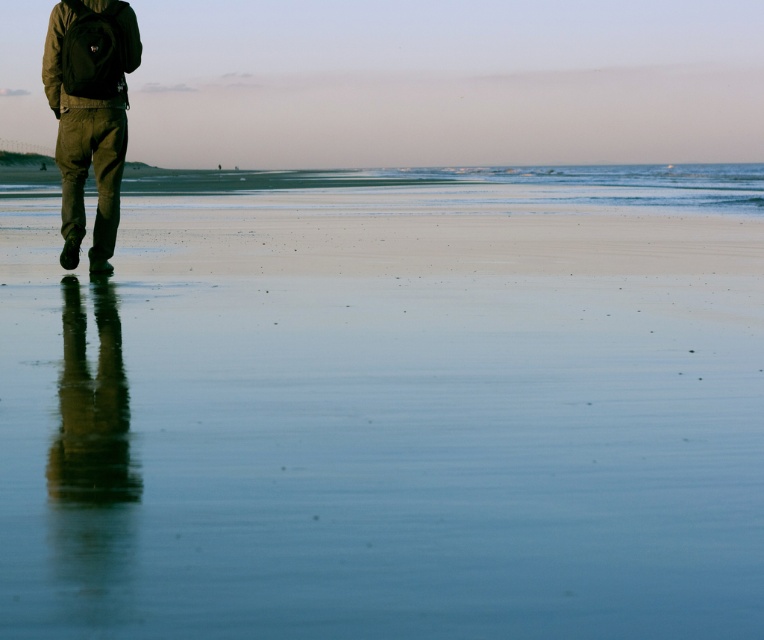
Question: Where is smooth sand at lower left located in relation to olive green corduroy pants at left in the image?

Choices:
 (A) below
 (B) above

Answer: (B)

Question: Can you confirm if smooth sand at lower left is positioned above olive green corduroy pants at left?

Choices:
 (A) yes
 (B) no

Answer: (A)

Question: Is smooth sand at lower left to the left of olive green corduroy pants at left from the viewer's perspective?

Choices:
 (A) yes
 (B) no

Answer: (B)